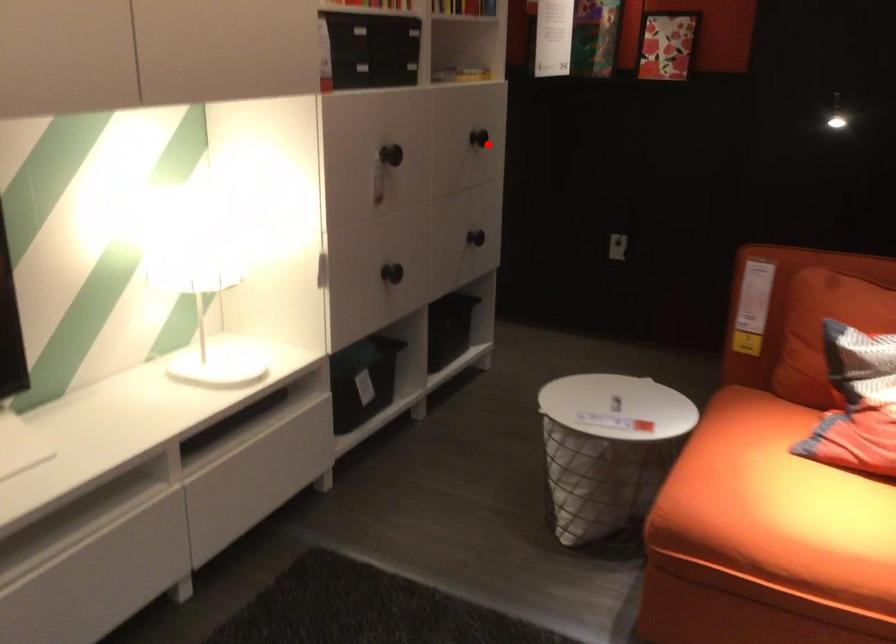
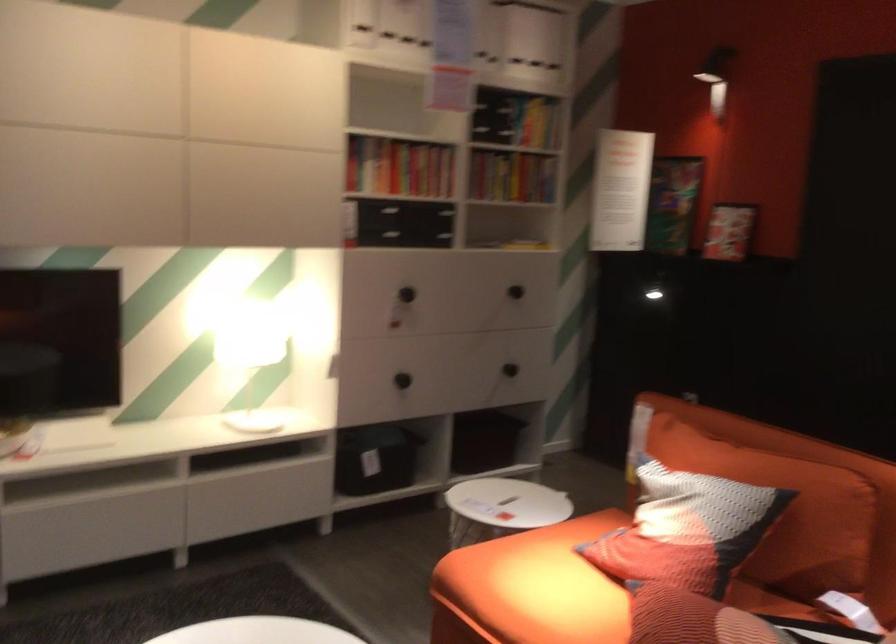
Question: I am providing you with two images of the same scene from different viewpoints. A red point is marked on the first image. Can you still see the location of the red point in image 2?

Choices:
 (A) Yes
 (B) No

Answer: (A)